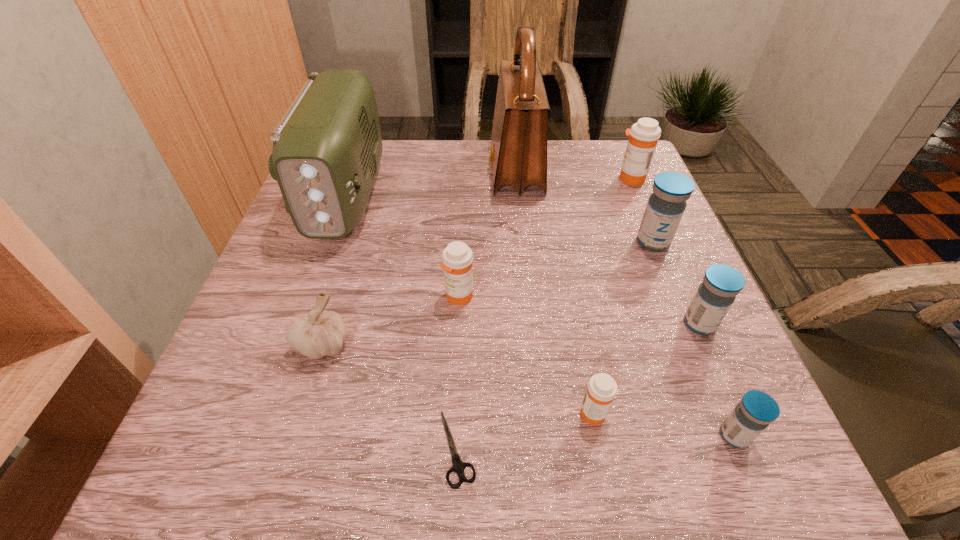
At what (x,y) coordinates should I click in order to perform the action: click on free space that satisfies the following two spatial constraints: 1. on the back side of the biggest blue medicine; 2. on the left side of the shortest object. Please return your answer as a coordinate pair (x, y). Image resolution: width=960 pixels, height=540 pixels. Looking at the image, I should click on (465, 242).

Locate an element on the screen. free space that satisfies the following two spatial constraints: 1. on the back side of the second farthest blue medicine; 2. on the right side of the black shears is located at coordinates (462, 324).

This screenshot has width=960, height=540. I want to click on blank area in the image that satisfies the following two spatial constraints: 1. on the front-facing side of the second orange medicine from left to right; 2. on the right side of the radio_receiver, so click(268, 413).

You are a GUI agent. You are given a task and a screenshot of the screen. Output one action in this format:
    pyautogui.click(x=<x>, y=<y>)
    Task: Click on the vacant space that satisfies the following two spatial constraints: 1. on the front flap of the nearest blue medicine; 2. on the right side of the tallest object
    The width and height of the screenshot is (960, 540).
    Given the screenshot: What is the action you would take?
    pyautogui.click(x=542, y=436)